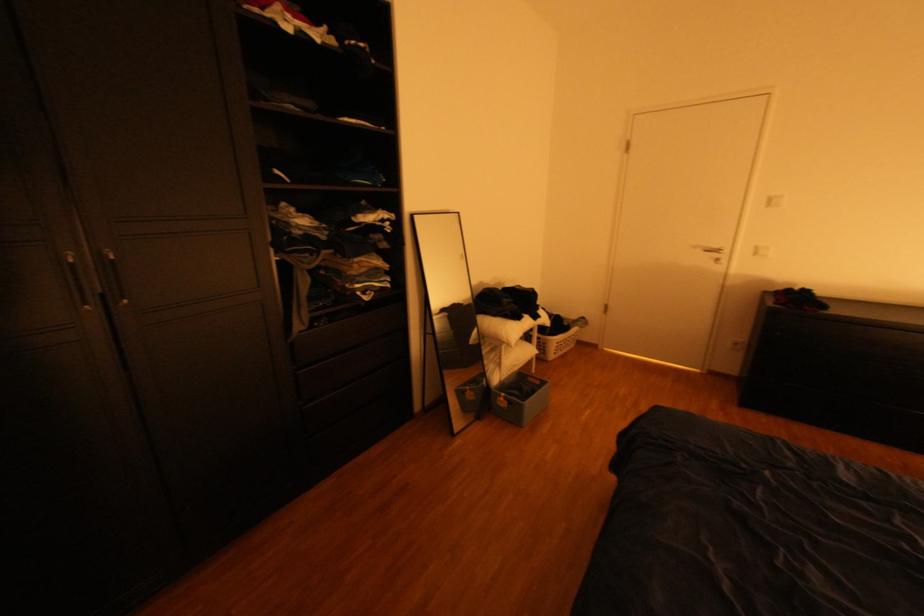
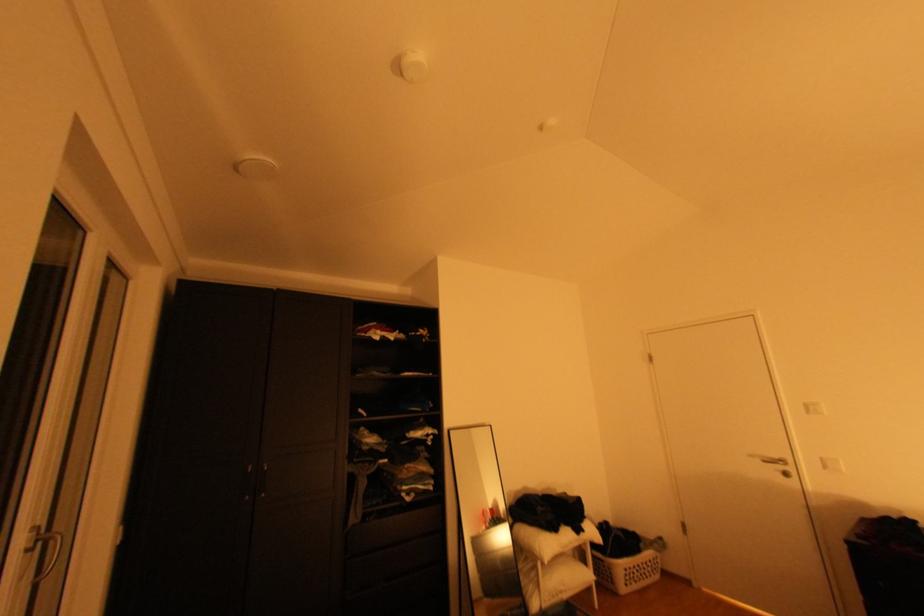
Where in the second image is the point corresponding to (x=725, y=246) from the first image?

(786, 456)